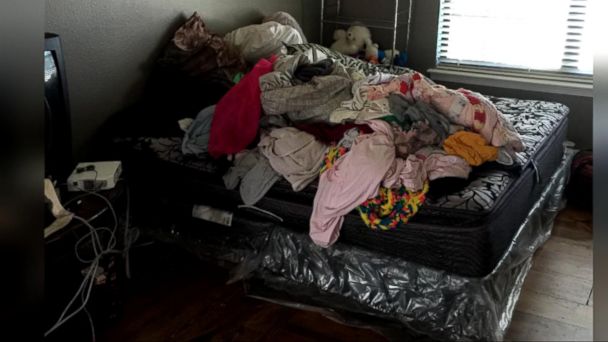
Identify the location of brown wood floor. (554, 291).